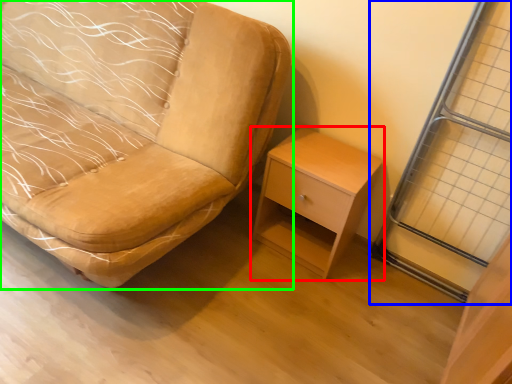
Question: Which object is positioned farthest from nightstand (highlighted by a red box)? Select from screen door (highlighted by a blue box) and chair (highlighted by a green box).

Choices:
 (A) screen door
 (B) chair

Answer: (B)